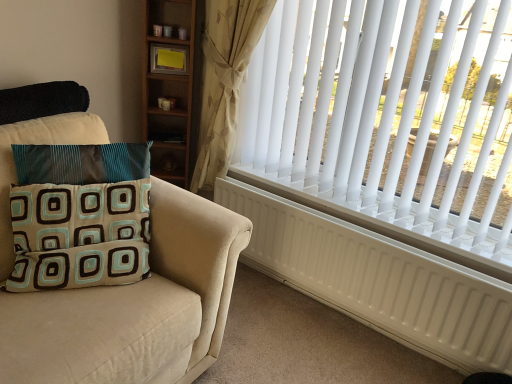
Question: Considering the relative positions of beige floral fabric curtain at upper right and white plastic blinds at upper right in the image provided, is beige floral fabric curtain at upper right to the left of white plastic blinds at upper right from the viewer's perspective?

Choices:
 (A) yes
 (B) no

Answer: (A)

Question: Does beige floral fabric curtain at upper right have a smaller size compared to white plastic blinds at upper right?

Choices:
 (A) no
 (B) yes

Answer: (B)

Question: From the image's perspective, is beige floral fabric curtain at upper right beneath white plastic blinds at upper right?

Choices:
 (A) no
 (B) yes

Answer: (A)

Question: Is beige floral fabric curtain at upper right thinner than white plastic blinds at upper right?

Choices:
 (A) yes
 (B) no

Answer: (A)

Question: Is beige floral fabric curtain at upper right located outside white plastic blinds at upper right?

Choices:
 (A) yes
 (B) no

Answer: (A)

Question: Considering the relative sizes of beige floral fabric curtain at upper right and white plastic blinds at upper right in the image provided, is beige floral fabric curtain at upper right wider than white plastic blinds at upper right?

Choices:
 (A) no
 (B) yes

Answer: (A)

Question: From the image's perspective, would you say white matte radiator at right is shown under white plastic blinds at upper right?

Choices:
 (A) yes
 (B) no

Answer: (A)

Question: Considering the relative positions of white matte radiator at right and white plastic blinds at upper right in the image provided, is white matte radiator at right to the left of white plastic blinds at upper right from the viewer's perspective?

Choices:
 (A) yes
 (B) no

Answer: (A)

Question: From a real-world perspective, is white matte radiator at right on white plastic blinds at upper right?

Choices:
 (A) no
 (B) yes

Answer: (A)

Question: Could white plastic blinds at upper right be considered to be inside white matte radiator at right?

Choices:
 (A) yes
 (B) no

Answer: (B)

Question: Could you tell me if white matte radiator at right is turned towards white plastic blinds at upper right?

Choices:
 (A) yes
 (B) no

Answer: (B)

Question: Can you confirm if white matte radiator at right is shorter than white plastic blinds at upper right?

Choices:
 (A) yes
 (B) no

Answer: (A)

Question: Considering the relative sizes of teal and brown fabric pillow at left and white matte radiator at right in the image provided, is teal and brown fabric pillow at left thinner than white matte radiator at right?

Choices:
 (A) yes
 (B) no

Answer: (B)